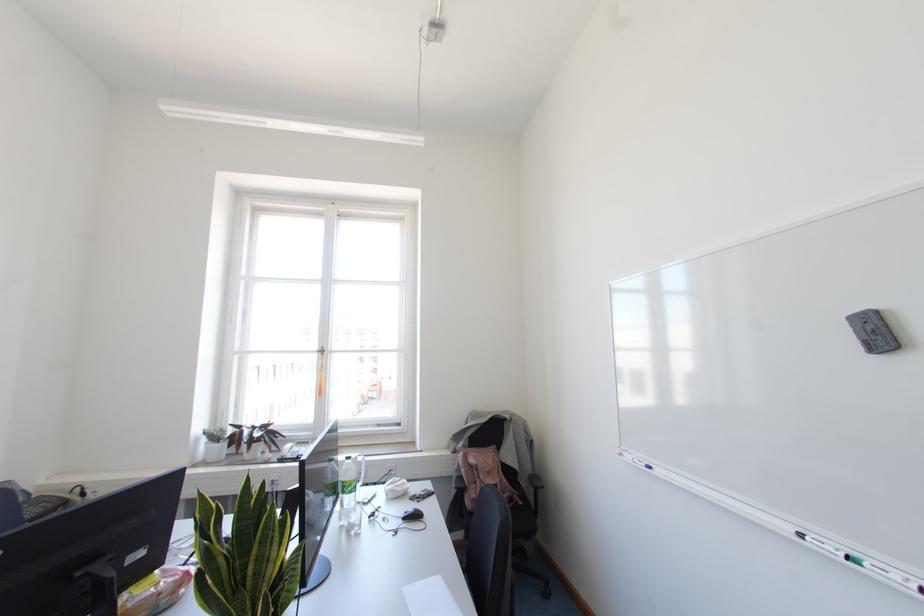
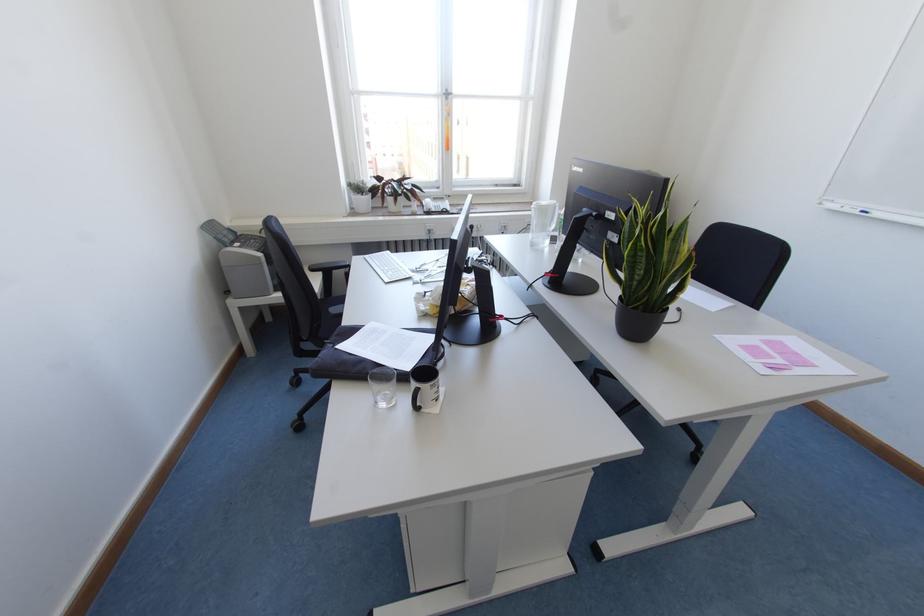
In the second image, find the point that corresponds to point (268, 546) in the first image.

(677, 243)